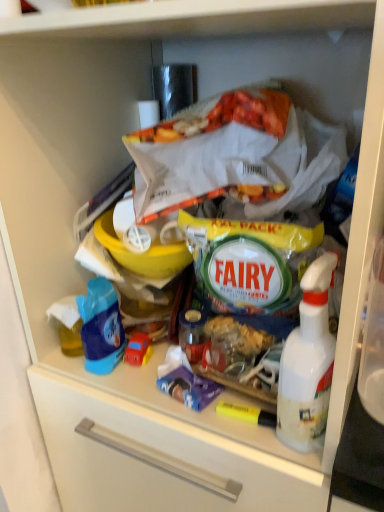
The image size is (384, 512). Find the location of `rubber car at center`. rubber car at center is located at coordinates (138, 349).

Based on the photo, is the depth of rubber car at center greater than that of white plastic spray bottle at right?

That is True.

Which is closer, (132, 357) or (279, 437)?

Point (132, 357).

Is rubber car at center far away from white plastic spray bottle at right?

No.

From the image's perspective, who appears lower, rubber car at center or white plastic spray bottle at right?

From the image's view, rubber car at center is below.

Is rubber car at center not inside blue plastic toy car at left?

Yes, rubber car at center is outside of blue plastic toy car at left.

Is rubber car at center next to blue plastic toy car at left and touching it?

Indeed, rubber car at center and blue plastic toy car at left are beside each other and touching.

Who is bigger, rubber car at center or blue plastic toy car at left?

With larger size is blue plastic toy car at left.

Does rubber car at center turn towards blue plastic toy car at left?

No, rubber car at center is not oriented towards blue plastic toy car at left.

From the image's perspective, is white plastic spray bottle at right beneath rubber car at center?

Incorrect, from the image's perspective, white plastic spray bottle at right is higher than rubber car at center.

Between white plastic spray bottle at right and rubber car at center, which one has larger size?

With larger size is white plastic spray bottle at right.

How distant is white plastic spray bottle at right from rubber car at center?

They are 34.69 centimeters apart.

Would you consider white plastic spray bottle at right to be distant from rubber car at center?

They are positioned close to each other.

Between point (283, 404) and point (87, 285), which one is positioned behind?

The point (87, 285) is more distant.

From a real-world perspective, between white plastic spray bottle at right and blue plastic toy car at left, who is vertically lower?

In real-world perspective, blue plastic toy car at left is lower.

Is white plastic spray bottle at right not within blue plastic toy car at left?

white plastic spray bottle at right is positioned outside blue plastic toy car at left.

At what (x,y) coordinates should I click in order to perform the action: click on bottle that is below the blue plastic toy car at left (from the image's perspective). Please return your answer as a coordinate pair (x, y). Looking at the image, I should click on coord(308,362).

Is blue plastic toy car at left oriented away from white plastic spray bottle at right?

blue plastic toy car at left does not have its back to white plastic spray bottle at right.

Is there a large distance between blue plastic toy car at left and white plastic spray bottle at right?

Actually, blue plastic toy car at left and white plastic spray bottle at right are a little close together.

Would you say blue plastic toy car at left is outside white plastic spray bottle at right?

blue plastic toy car at left lies outside white plastic spray bottle at right's area.

Based on the photo, can you tell me how much blue plastic toy car at left and white plastic spray bottle at right differ in facing direction?

The angle between the facing direction of blue plastic toy car at left and the facing direction of white plastic spray bottle at right is 0.00375 degrees.

Which object is more forward, blue plastic toy car at left or rubber car at center?

blue plastic toy car at left is closer to the camera.

From a real-world perspective, is blue plastic toy car at left physically located above or below rubber car at center?

Clearly, from a real-world perspective, blue plastic toy car at left is above rubber car at center.

Considering the relative sizes of blue plastic toy car at left and rubber car at center in the image provided, is blue plastic toy car at left shorter than rubber car at center?

In fact, blue plastic toy car at left may be taller than rubber car at center.

Which object is positioned more to the right, blue plastic toy car at left or rubber car at center?

rubber car at center.

In the image, there is a white plastic spray bottle at right. Where is `toy below it (from the image's perspective)`? toy below it (from the image's perspective) is located at coordinates (138, 349).

In order to click on product in front of the rubber car at center in this screenshot , I will do `click(101, 327)`.

Which object lies nearer to the anchor point rubber car at center, blue plastic toy car at left or white plastic spray bottle at right?

Based on the image, blue plastic toy car at left appears to be nearer to rubber car at center.

Which object lies nearer to the anchor point white plastic spray bottle at right, blue plastic toy car at left or rubber car at center?

The object closer to white plastic spray bottle at right is rubber car at center.

When comparing their distances from white plastic spray bottle at right, does rubber car at center or blue plastic toy car at left seem closer?

rubber car at center lies closer to white plastic spray bottle at right than the other object.

Consider the image. Considering their positions, is white plastic spray bottle at right positioned further to rubber car at center than blue plastic toy car at left?

white plastic spray bottle at right is positioned further to the anchor rubber car at center.

Looking at the image, which one is located further to blue plastic toy car at left, white plastic spray bottle at right or rubber car at center?

white plastic spray bottle at right.

Considering their positions, is rubber car at center positioned further to blue plastic toy car at left than white plastic spray bottle at right?

white plastic spray bottle at right is positioned further to the anchor blue plastic toy car at left.

Where is `toy located between blue plastic toy car at left and white plastic spray bottle at right in the left-right direction`? toy located between blue plastic toy car at left and white plastic spray bottle at right in the left-right direction is located at coordinates (138, 349).